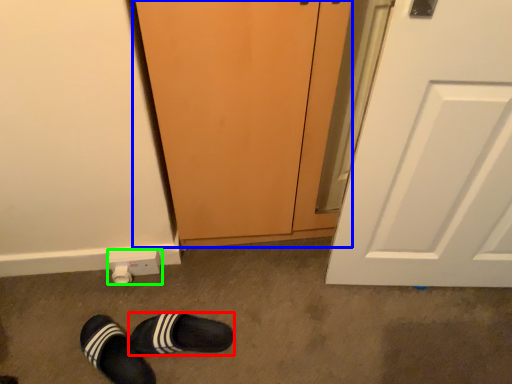
Question: Which object is positioned closest to footwear (highlighted by a red box)? Select from screen door (highlighted by a blue box) and electric outlet (highlighted by a green box).

Choices:
 (A) screen door
 (B) electric outlet

Answer: (B)